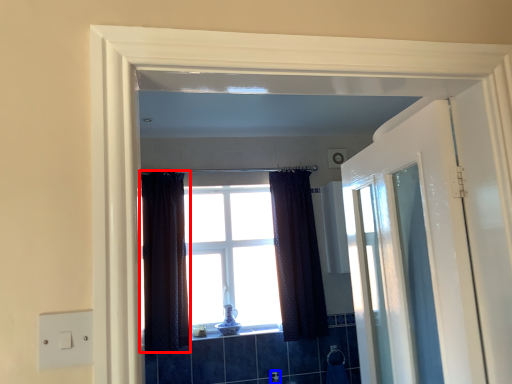
Question: Among these objects, which one is nearest to the camera, curtain (highlighted by a red box) or faucet (highlighted by a blue box)?

Choices:
 (A) curtain
 (B) faucet

Answer: (A)